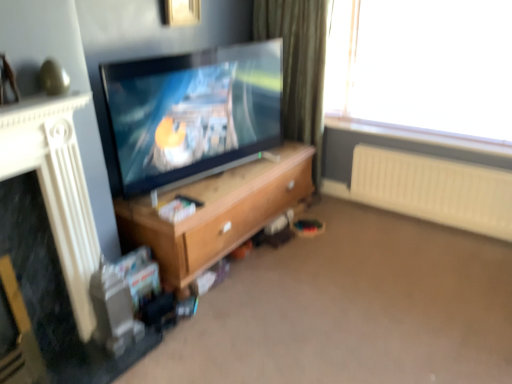
Question: In which direction should I rotate to look at metallic gold picture frame at upper center?

Choices:
 (A) left
 (B) right

Answer: (A)

Question: Is matte black tv at center positioned behind white plastic radiator at right?

Choices:
 (A) yes
 (B) no

Answer: (B)

Question: Can you confirm if matte black tv at center is taller than white plastic radiator at right?

Choices:
 (A) no
 (B) yes

Answer: (B)

Question: Is the surface of matte black tv at center in direct contact with white plastic radiator at right?

Choices:
 (A) no
 (B) yes

Answer: (A)

Question: Can you confirm if matte black tv at center is smaller than white plastic radiator at right?

Choices:
 (A) no
 (B) yes

Answer: (A)

Question: Is matte black tv at center outside white plastic radiator at right?

Choices:
 (A) yes
 (B) no

Answer: (A)

Question: Does matte black tv at center appear on the left side of white plastic radiator at right?

Choices:
 (A) no
 (B) yes

Answer: (B)

Question: Considering the relative sizes of metallic gold picture frame at upper center and white textured fireplace at left in the image provided, is metallic gold picture frame at upper center wider than white textured fireplace at left?

Choices:
 (A) no
 (B) yes

Answer: (A)

Question: Would you say white textured fireplace at left is part of metallic gold picture frame at upper center's contents?

Choices:
 (A) yes
 (B) no

Answer: (B)

Question: Can you confirm if metallic gold picture frame at upper center is smaller than white textured fireplace at left?

Choices:
 (A) yes
 (B) no

Answer: (A)

Question: Does metallic gold picture frame at upper center have a greater height compared to white textured fireplace at left?

Choices:
 (A) no
 (B) yes

Answer: (A)

Question: From the image's perspective, would you say metallic gold picture frame at upper center is shown under white textured fireplace at left?

Choices:
 (A) yes
 (B) no

Answer: (B)

Question: Is metallic gold picture frame at upper center shorter than white textured fireplace at left?

Choices:
 (A) yes
 (B) no

Answer: (A)

Question: Is metallic gold picture frame at upper center completely or partially inside white plastic radiator at right?

Choices:
 (A) yes
 (B) no

Answer: (B)